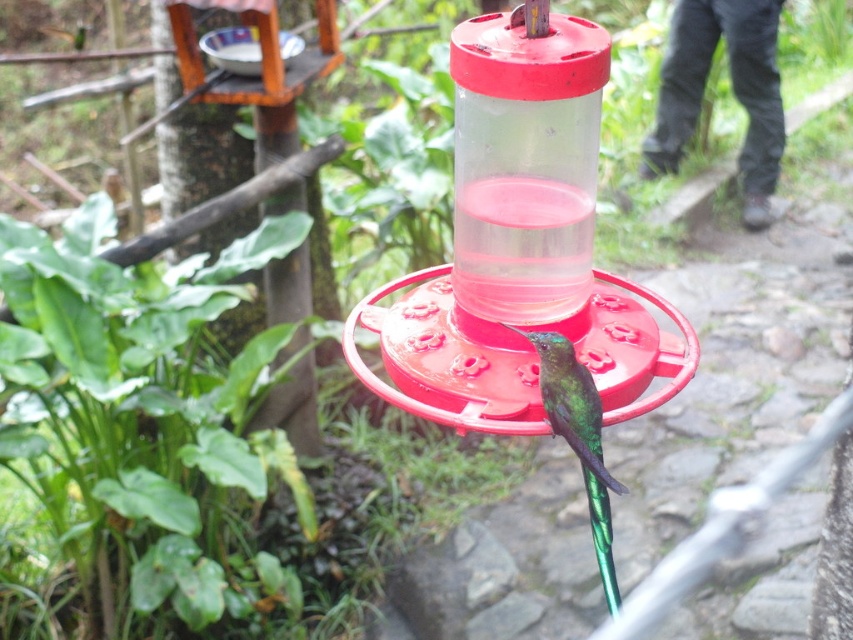
Question: Which point is closer to the camera taking this photo?

Choices:
 (A) (567, 397)
 (B) (503, 394)

Answer: (A)

Question: From the image, what is the correct spatial relationship of transparent plastic bird feeder at center in relation to green iridescent bird at center?

Choices:
 (A) left
 (B) right

Answer: (A)

Question: Does transparent plastic bird feeder at center have a lesser width compared to green iridescent bird at center?

Choices:
 (A) no
 (B) yes

Answer: (A)

Question: Is transparent plastic bird feeder at center positioned behind green iridescent bird at center?

Choices:
 (A) yes
 (B) no

Answer: (B)